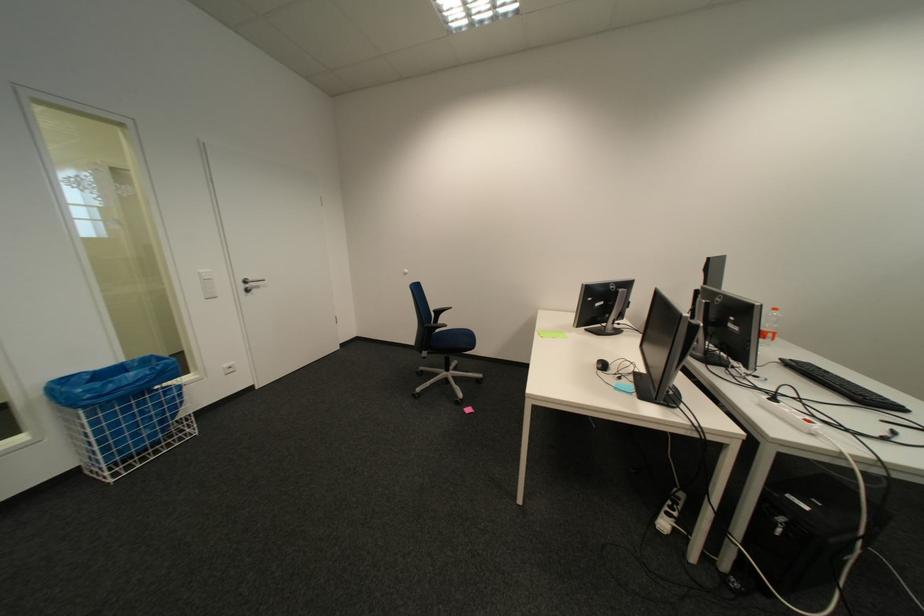
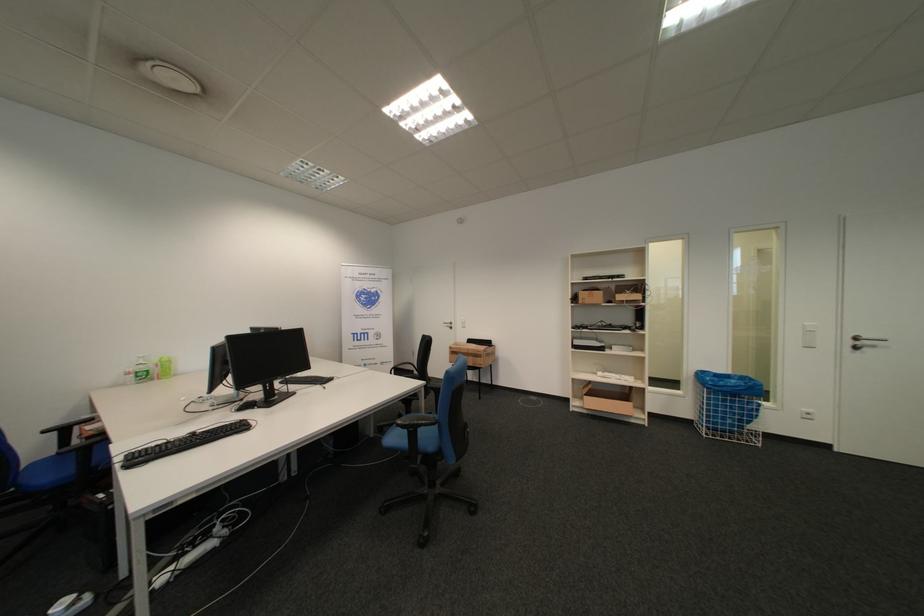
Locate, in the second image, the point that corresponds to the point at 139,411 in the first image.

(736, 402)